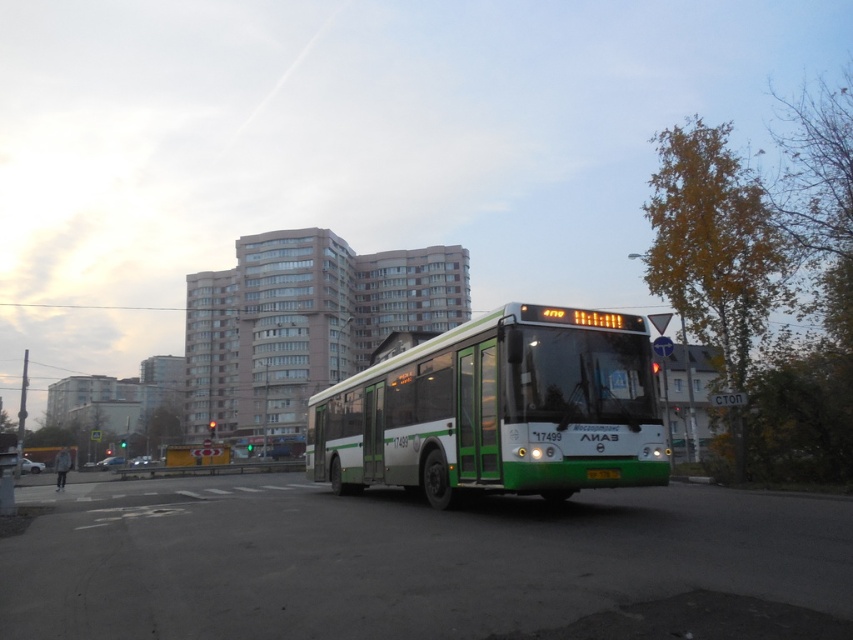
You are driving a metallic silver car at center and want to overtake the silver metallic car at lower left. Given that your car can accelerate up to 120 km per hour and the other car is moving at 60 km per hour, can you safely overtake within the next 100 meters?

The metallic silver car at center is 8.02 meters away from the silver metallic car at lower left. To overtake safely within 100 meters, you need to calculate the distance required. The relative speed is 60 km per hour, so the time to overtake would be approximately 48 seconds. In that time, your car would cover about 1600 meters, which is more than enough to overtake within 100 meters. However, the distance between the cars is only 8.02 meters, so you can safely overtake within the next 100 meters.

You are standing on the sidewalk and see two points on the road ahead. The first point is at coordinates point (x=111, y=458) and the second is at point (x=30, y=472). Which point is closer to you?

Point (x=111, y=458) is closer to you because it is further to the viewer than point (x=30, y=472).